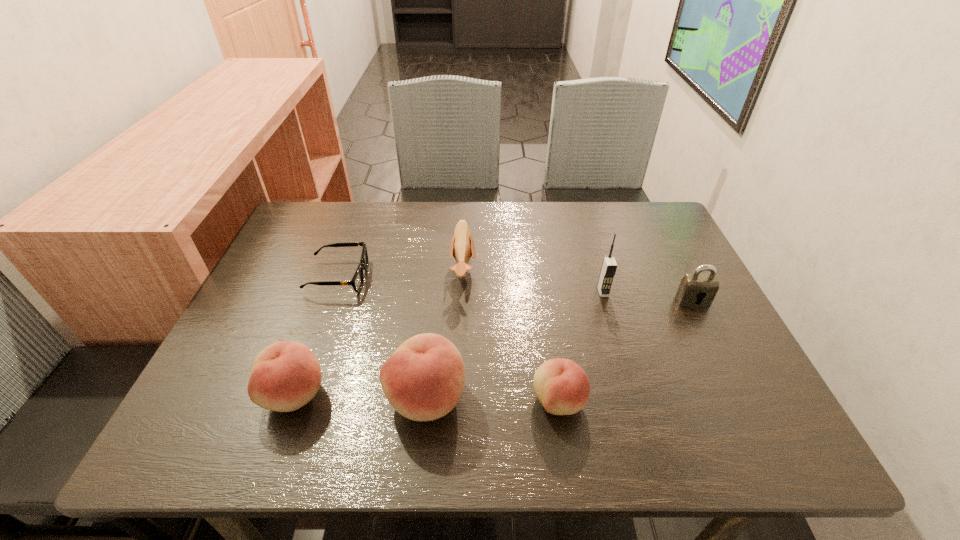
Locate an element on the screen. free area in between the bird and the rightmost peach is located at coordinates (511, 336).

The width and height of the screenshot is (960, 540). Identify the location of free space between the fifth object from left to right and the second object from right to left. (581, 346).

The width and height of the screenshot is (960, 540). In order to click on vacant area that lies between the bird and the cellular telephone in this screenshot , I will do `click(533, 281)`.

Where is `free space between the bird and the rightmost object`? Image resolution: width=960 pixels, height=540 pixels. free space between the bird and the rightmost object is located at coordinates (578, 286).

At what (x,y) coordinates should I click in order to perform the action: click on vacant space in between the second peach from left to right and the sunglasses. Please return your answer as a coordinate pair (x, y). The width and height of the screenshot is (960, 540). Looking at the image, I should click on (382, 338).

The height and width of the screenshot is (540, 960). In order to click on free spot between the second tallest peach and the bird in this screenshot , I will do click(379, 333).

Select which object appears as the sixth closest to the second object from right to left. Please provide its 2D coordinates. Your answer should be formatted as a tuple, i.e. [(x, y)], where the tuple contains the x and y coordinates of a point satisfying the conditions above.

[(286, 375)]

Identify which object is located as the sixth nearest to the padlock. Please provide its 2D coordinates. Your answer should be formatted as a tuple, i.e. [(x, y)], where the tuple contains the x and y coordinates of a point satisfying the conditions above.

[(286, 375)]

Find the location of a particular element. This screenshot has width=960, height=540. the second closest peach to the leftmost peach is located at coordinates (563, 388).

I want to click on the closest peach to the rightmost object, so click(x=563, y=388).